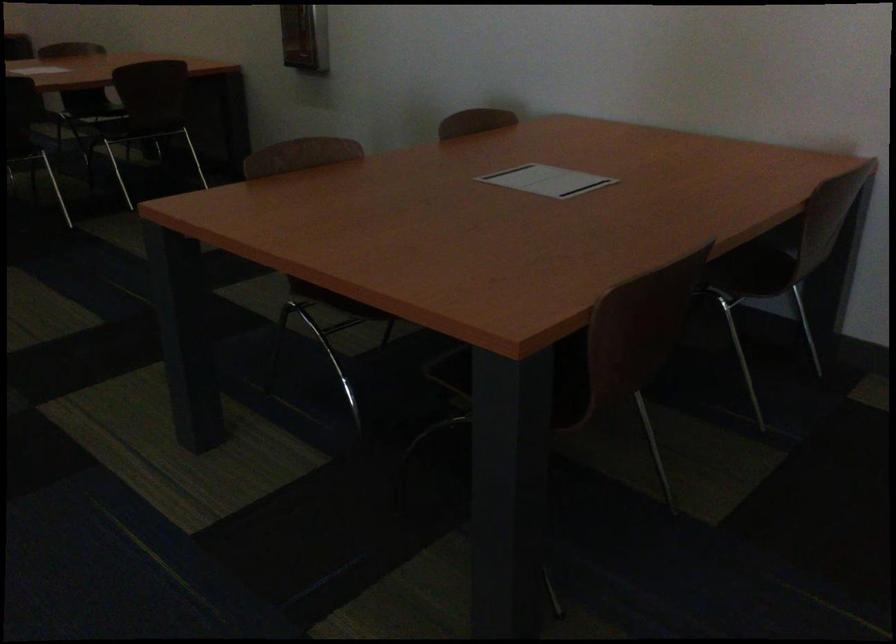
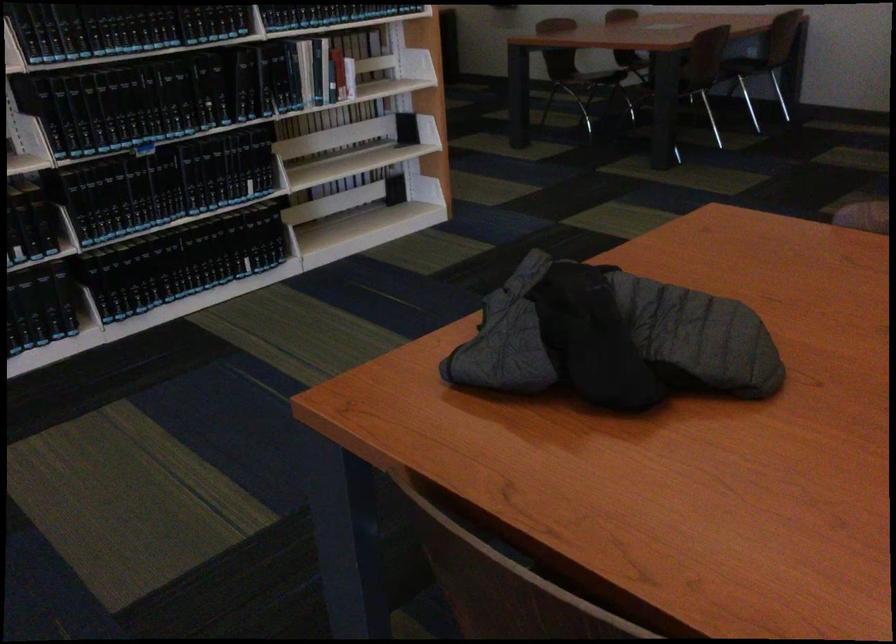
The point at [772,289] is marked in the first image. Where is the corresponding point in the second image?

(743, 58)